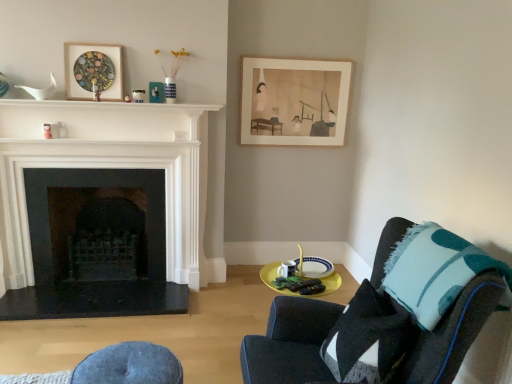
Question: Is teal felt throw pillow at right not near wooden stained picture frame at upper left, positioned as the 1th picture frame in front-to-back order?

Choices:
 (A) yes
 (B) no

Answer: (A)

Question: Does teal felt throw pillow at right have a greater height compared to wooden stained picture frame at upper left, which ranks as the 1th picture frame in left-to-right order?

Choices:
 (A) no
 (B) yes

Answer: (A)

Question: Considering the relative positions of teal felt throw pillow at right and wooden stained picture frame at upper left, the 3th picture frame in the right-to-left sequence, in the image provided, is teal felt throw pillow at right behind wooden stained picture frame at upper left, the 3th picture frame in the right-to-left sequence,?

Choices:
 (A) no
 (B) yes

Answer: (A)

Question: Can you confirm if teal felt throw pillow at right is positioned to the right of wooden stained picture frame at upper left, the 3th picture frame in the right-to-left sequence?

Choices:
 (A) yes
 (B) no

Answer: (A)

Question: Is teal felt throw pillow at right completely or partially outside of wooden stained picture frame at upper left, arranged as the 3th picture frame when viewed from the back?

Choices:
 (A) yes
 (B) no

Answer: (A)

Question: From their relative heights in the image, would you say matte paper picture frame at upper center, the 3th picture frame when ordered from front to back, is taller or shorter than black stone fireplace at left, which ranks as the first fireplace in back-to-front order?

Choices:
 (A) tall
 (B) short

Answer: (B)

Question: Based on their positions, is matte paper picture frame at upper center, the 3th picture frame when ordered from front to back, located to the left or right of black stone fireplace at left, which ranks as the first fireplace in back-to-front order?

Choices:
 (A) left
 (B) right

Answer: (B)

Question: Is point (330, 91) closer or farther from the camera than point (34, 168)?

Choices:
 (A) closer
 (B) farther

Answer: (B)

Question: Is matte paper picture frame at upper center, the 1th picture frame from the right, wider or thinner than black stone fireplace at left, which ranks as the first fireplace in back-to-front order?

Choices:
 (A) thin
 (B) wide

Answer: (A)

Question: Based on their sizes in the image, would you say teal felt throw pillow at right is bigger or smaller than denim cushion at lower center?

Choices:
 (A) small
 (B) big

Answer: (B)

Question: Is teal felt throw pillow at right in front of or behind denim cushion at lower center in the image?

Choices:
 (A) behind
 (B) front

Answer: (B)

Question: In terms of width, does teal felt throw pillow at right look wider or thinner when compared to denim cushion at lower center?

Choices:
 (A) thin
 (B) wide

Answer: (A)

Question: Is teal felt throw pillow at right situated inside denim cushion at lower center or outside?

Choices:
 (A) outside
 (B) inside

Answer: (A)

Question: Looking at their shapes, would you say denim cushion at lower center is wider or thinner than matte black picture frame at upper center, the 2th picture frame in the right-to-left sequence?

Choices:
 (A) thin
 (B) wide

Answer: (B)

Question: Is denim cushion at lower center to the left or to the right of matte black picture frame at upper center, the 2th picture frame in the right-to-left sequence, in the image?

Choices:
 (A) left
 (B) right

Answer: (B)